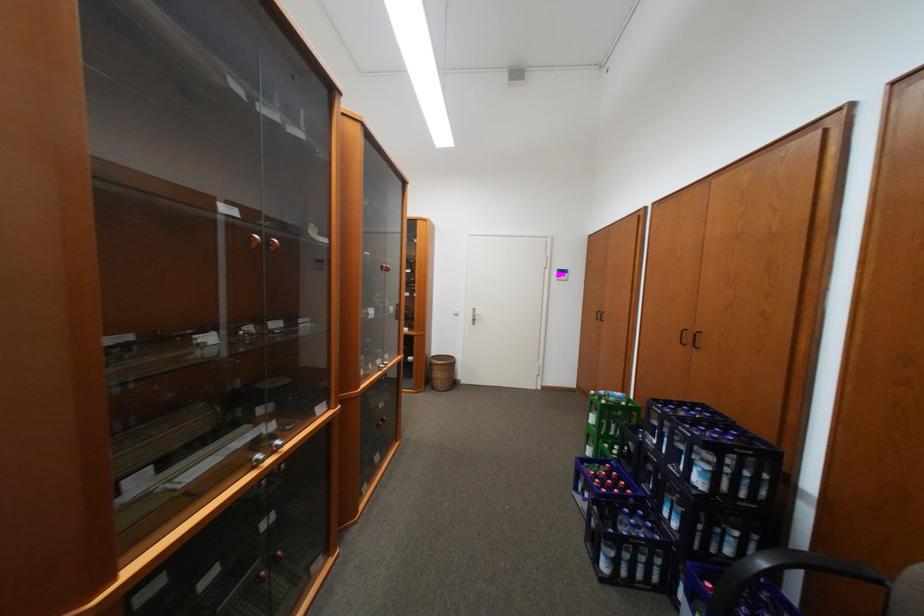
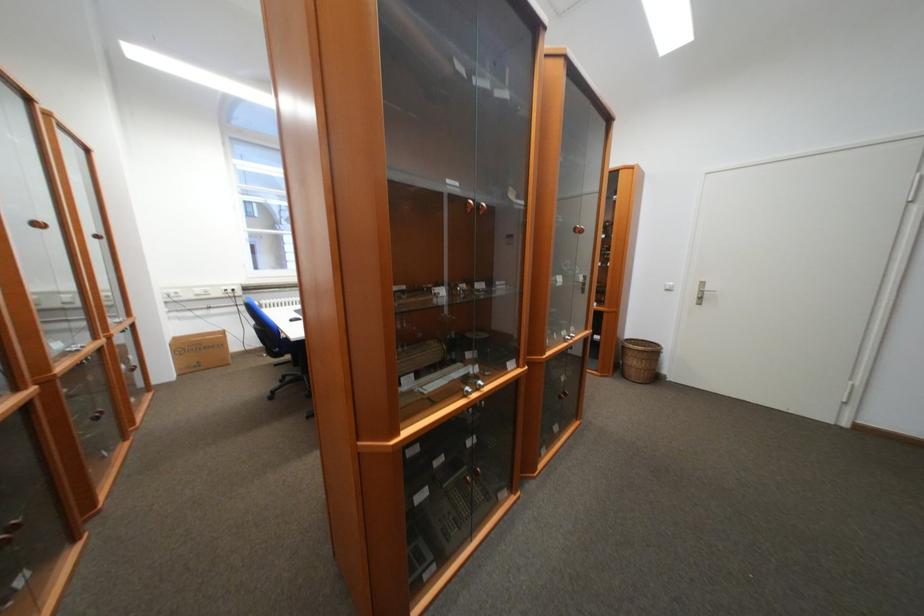
Locate, in the second image, the point that corresponds to the point at 262,238 in the first image.

(479, 204)